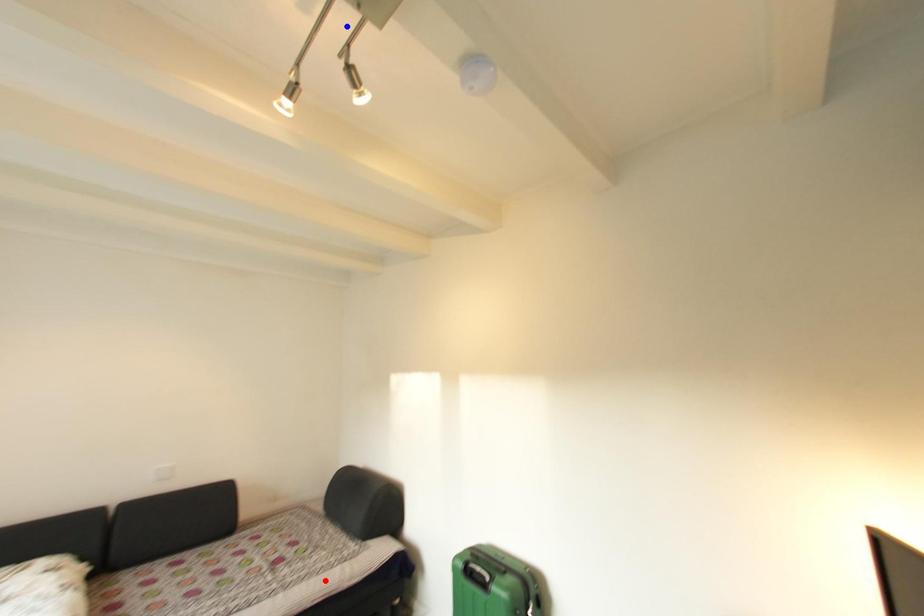
Question: Two points are marked on the image. Which point is closer to the camera?

Choices:
 (A) Blue point is closer.
 (B) Red point is closer.

Answer: (A)